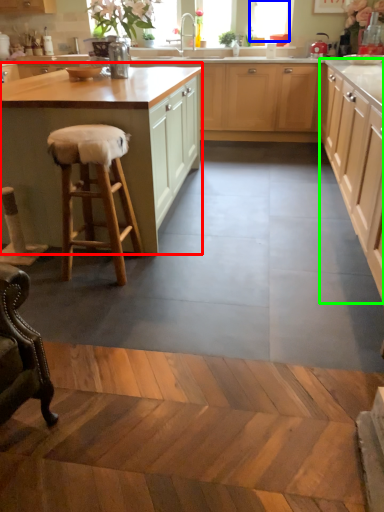
Question: Which object is the closest to the cabinetry (highlighted by a red box)? Choose among these: window (highlighted by a blue box) or cabinetry (highlighted by a green box).

Choices:
 (A) window
 (B) cabinetry

Answer: (B)